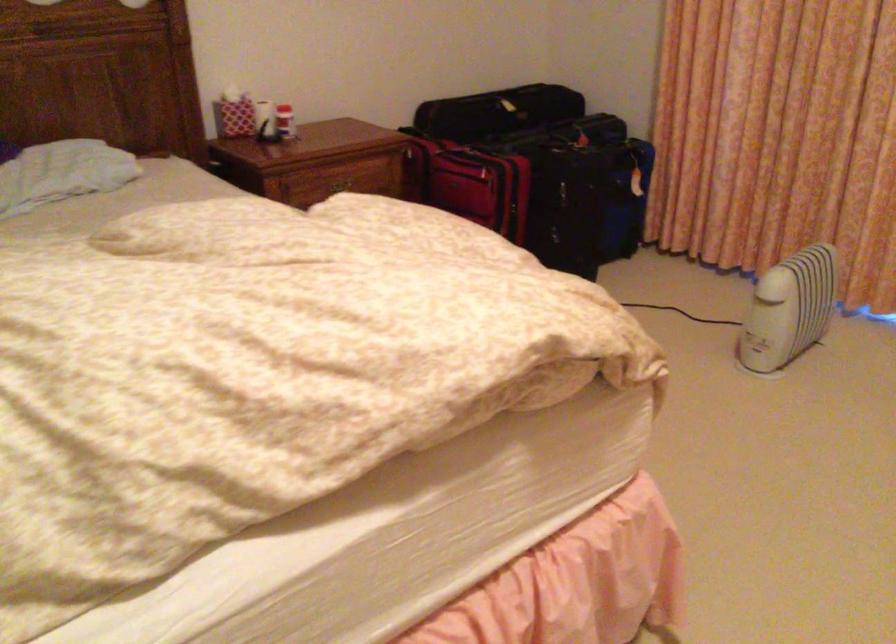
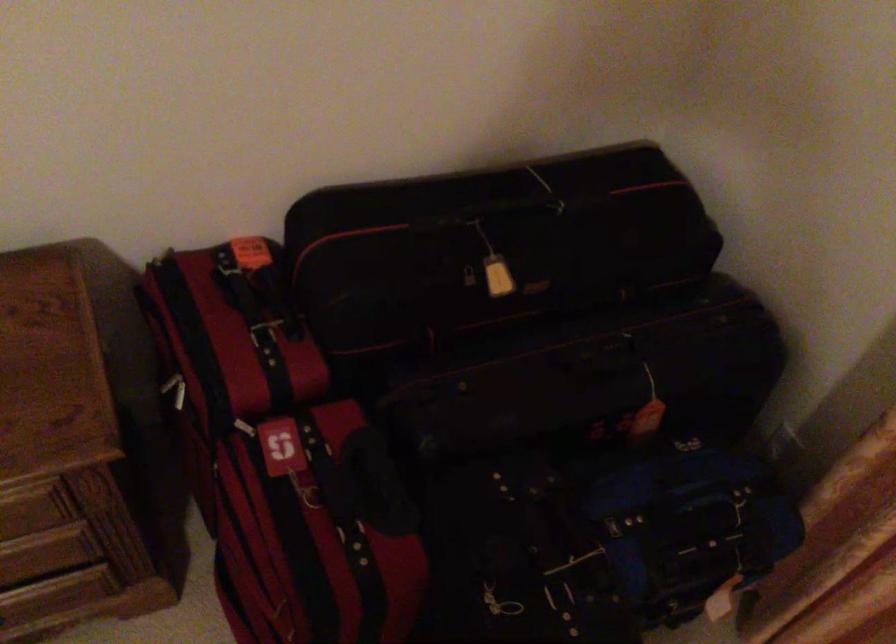
Find the pixel in the second image that matches the point at 496,106 in the first image.

(470, 287)